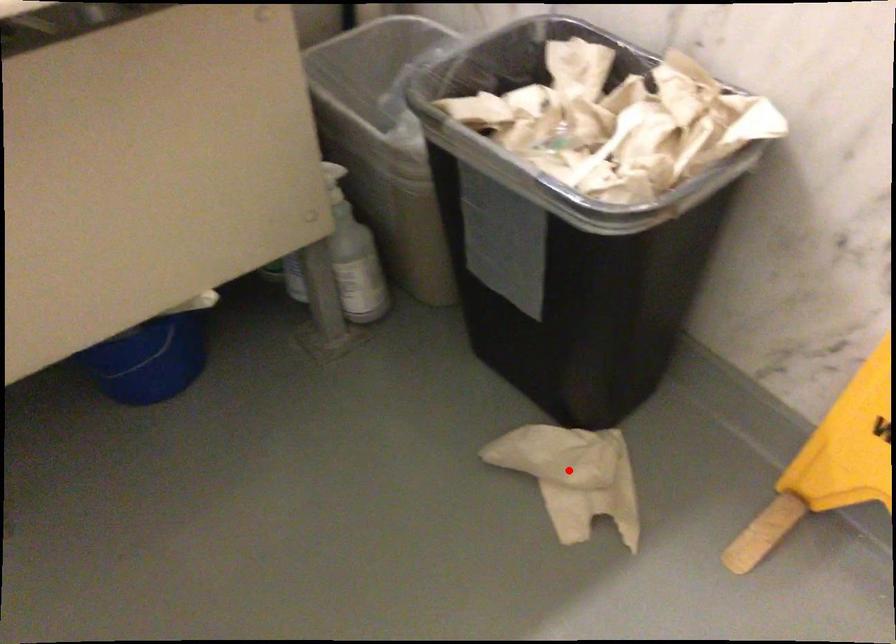
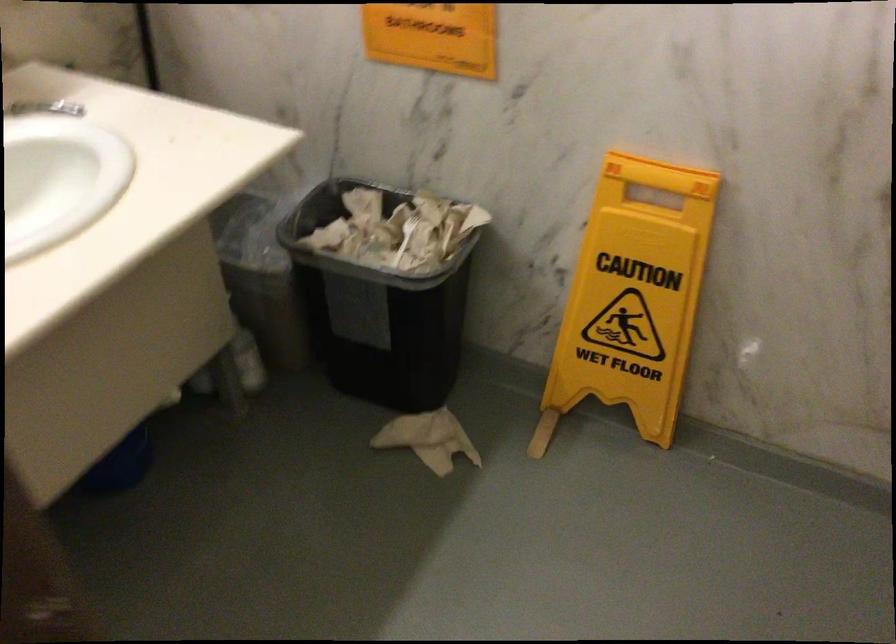
Question: A red point is marked in image1. In image2, is the corresponding 3D point closer to the camera or farther? Reply with the corresponding letter.

Choices:
 (A) The corresponding 3D point is closer.
 (B) The corresponding 3D point is farther.

Answer: (B)